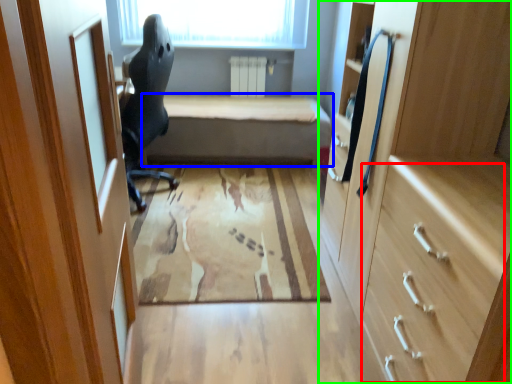
Question: Which object is the farthest from drawer (highlighted by a red box)? Choose among these: furniture (highlighted by a blue box) or cabinetry (highlighted by a green box).

Choices:
 (A) furniture
 (B) cabinetry

Answer: (A)